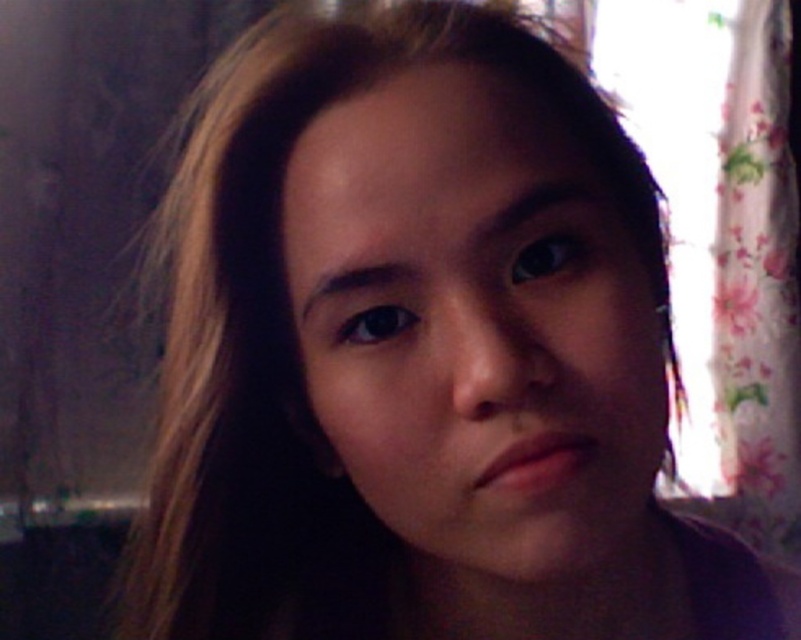
Question: Which point is closer to the camera?

Choices:
 (A) (749, 28)
 (B) (449, 465)

Answer: (B)

Question: Which object appears farthest from the camera in this image?

Choices:
 (A) floral fabric curtain at right
 (B) smooth skin face at center

Answer: (A)

Question: Does smooth skin face at center appear on the right side of floral fabric curtain at right?

Choices:
 (A) no
 (B) yes

Answer: (A)

Question: Is smooth skin face at center thinner than floral fabric curtain at right?

Choices:
 (A) no
 (B) yes

Answer: (B)

Question: Which point is farther to the camera?

Choices:
 (A) smooth skin face at center
 (B) floral fabric curtain at right

Answer: (B)

Question: Is the position of smooth skin face at center more distant than that of floral fabric curtain at right?

Choices:
 (A) no
 (B) yes

Answer: (A)